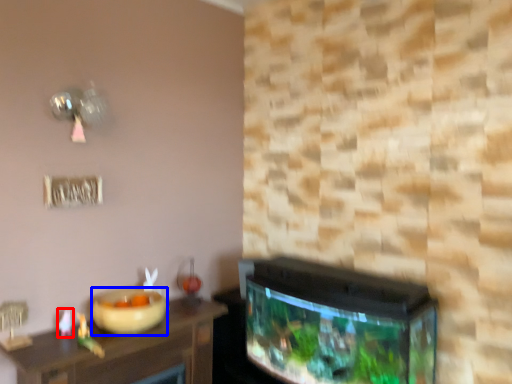
Question: Among these objects, which one is farthest to the camera, toy (highlighted by a red box) or bowl (highlighted by a blue box)?

Choices:
 (A) toy
 (B) bowl

Answer: (A)